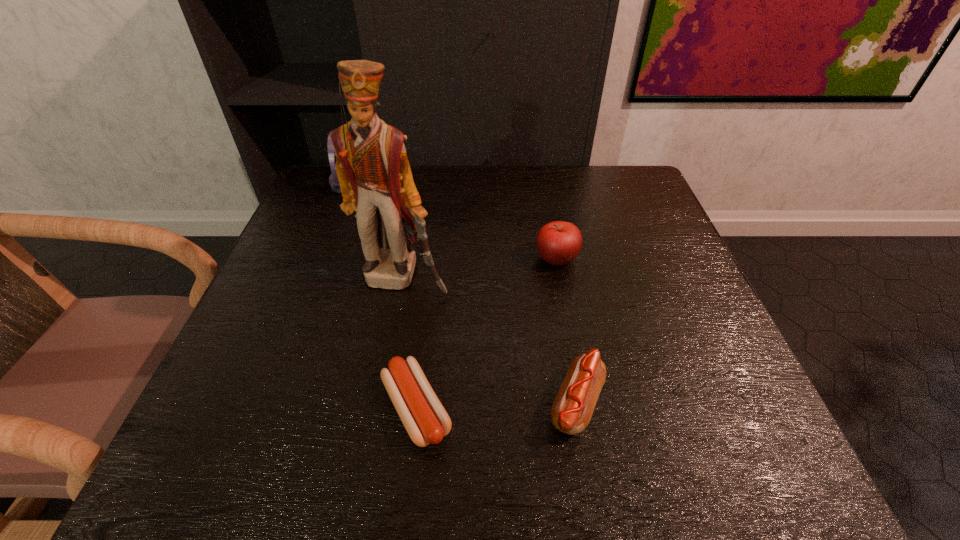
The image size is (960, 540). Find the location of `the tallest object`. the tallest object is located at coordinates (373, 170).

At what (x,y) coordinates should I click in order to perform the action: click on the farthest object. Please return your answer as a coordinate pair (x, y). Looking at the image, I should click on (333, 179).

The height and width of the screenshot is (540, 960). Find the location of `the leftmost object`. the leftmost object is located at coordinates (333, 179).

You are a GUI agent. You are given a task and a screenshot of the screen. Output one action in this format:
    pyautogui.click(x=<x>, y=<y>)
    Task: Click on the apple
    
    Given the screenshot: What is the action you would take?
    pyautogui.click(x=558, y=242)

This screenshot has height=540, width=960. In order to click on the taller sausage in this screenshot , I will do `click(572, 409)`.

Image resolution: width=960 pixels, height=540 pixels. Identify the location of the second shortest object. (572, 409).

Find the location of a particular element. the shortest object is located at coordinates (426, 421).

What are the coordinates of `the shorter sausage` in the screenshot? It's located at (426, 421).

Find the location of a particular element. Image resolution: width=960 pixels, height=540 pixels. free location located 0.250m on the front-facing side of the nutcracker is located at coordinates (380, 404).

The height and width of the screenshot is (540, 960). I want to click on free space located on the headband and ear cups of the leftmost object, so click(424, 185).